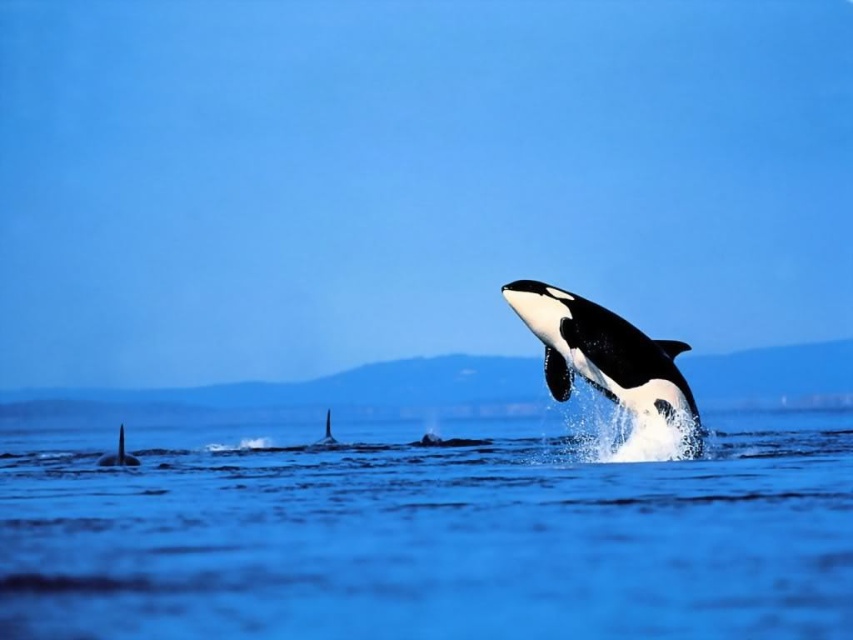
Consider the image. Does black/white whale at center appear under black smooth whale at center?

Actually, black/white whale at center is above black smooth whale at center.

Is point (573, 364) positioned behind point (321, 442)?

No.

Who is more forward, (524, 292) or (329, 426)?

Point (524, 292) is in front.

The height and width of the screenshot is (640, 853). I want to click on black/white whale at center, so click(605, 355).

Image resolution: width=853 pixels, height=640 pixels. What do you see at coordinates (605, 355) in the screenshot?
I see `black/white whale at center` at bounding box center [605, 355].

Is black/white whale at center positioned at the back of black smooth fin at left?

No, black/white whale at center is closer to the viewer.

This screenshot has width=853, height=640. What are the coordinates of `black/white whale at center` in the screenshot? It's located at (605, 355).

Can you confirm if blue water at center is thinner than black smooth fin at left?

No.

This screenshot has width=853, height=640. What do you see at coordinates (432, 536) in the screenshot? I see `blue water at center` at bounding box center [432, 536].

Is point (409, 602) positioned before point (119, 465)?

Yes.

This screenshot has height=640, width=853. I want to click on blue water at center, so click(x=432, y=536).